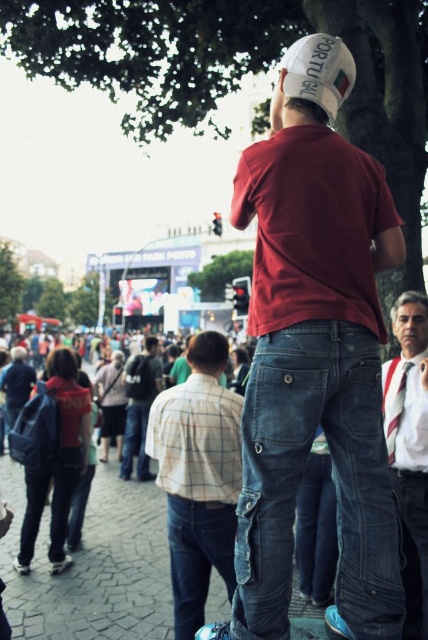
Question: Which point is farther from the camera taking this photo?

Choices:
 (A) (333, 81)
 (B) (269, 246)

Answer: (A)

Question: Does striped cotton shirt at lower right have a smaller size compared to dark blue jeans at center?

Choices:
 (A) yes
 (B) no

Answer: (A)

Question: Does white fabric baseball cap at upper center appear on the right side of striped cotton shirt at lower right?

Choices:
 (A) yes
 (B) no

Answer: (B)

Question: Does denim jeans at center have a greater width compared to dark blue jeans at center?

Choices:
 (A) yes
 (B) no

Answer: (A)

Question: Among these objects, which one is farthest from the camera?

Choices:
 (A) denim jeans at center
 (B) striped tie at center

Answer: (B)

Question: Which is nearer to the striped tie at center?

Choices:
 (A) white fabric baseball cap at upper center
 (B) checkered shirt at center
 (C) striped cotton shirt at lower right

Answer: (C)